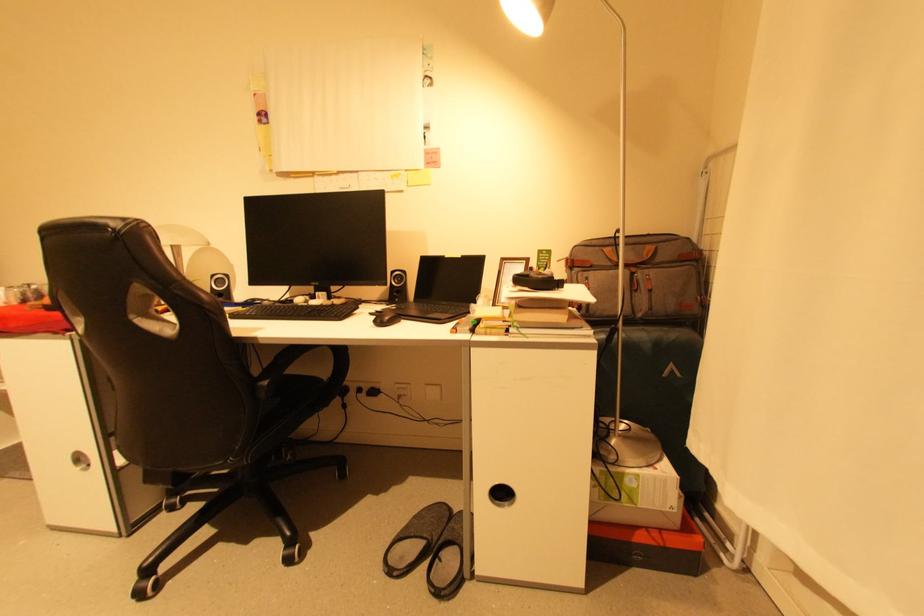
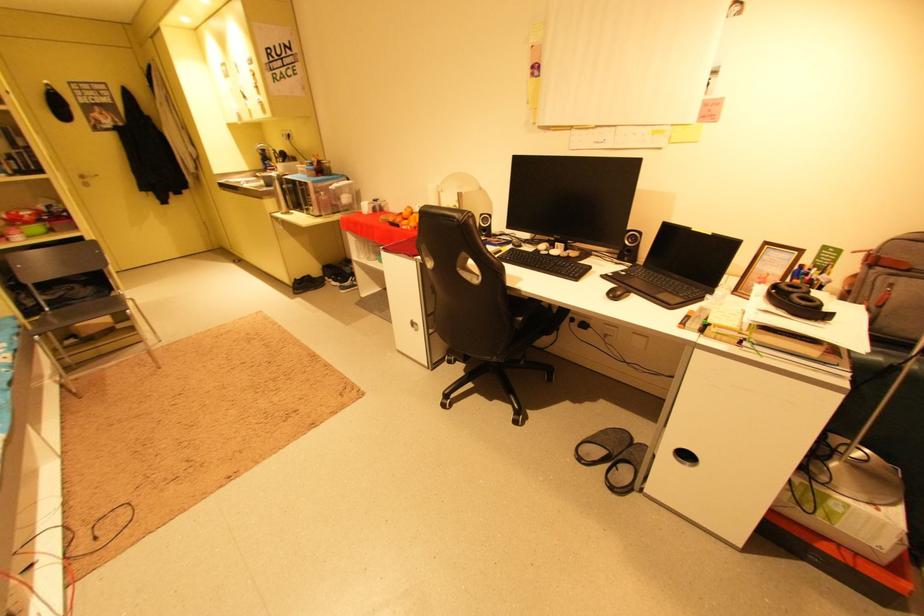
Where in the second image is the point corresponding to (432,536) from the first image?

(616, 448)